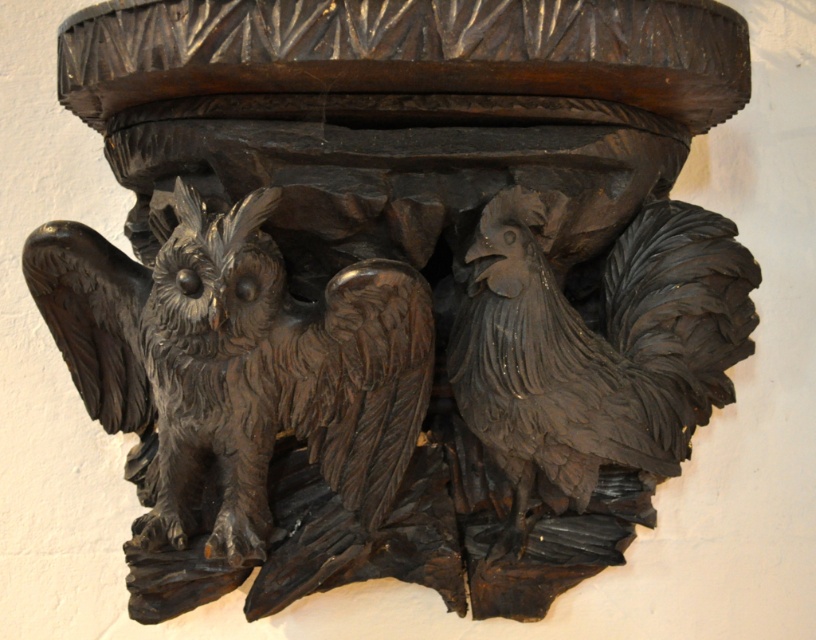
Is dark brown wood owl at left to the right of dark wood rooster at right from the viewer's perspective?

In fact, dark brown wood owl at left is to the left of dark wood rooster at right.

Can you confirm if dark brown wood owl at left is wider than dark wood rooster at right?

Correct, the width of dark brown wood owl at left exceeds that of dark wood rooster at right.

Image resolution: width=816 pixels, height=640 pixels. I want to click on dark brown wood owl at left, so click(238, 362).